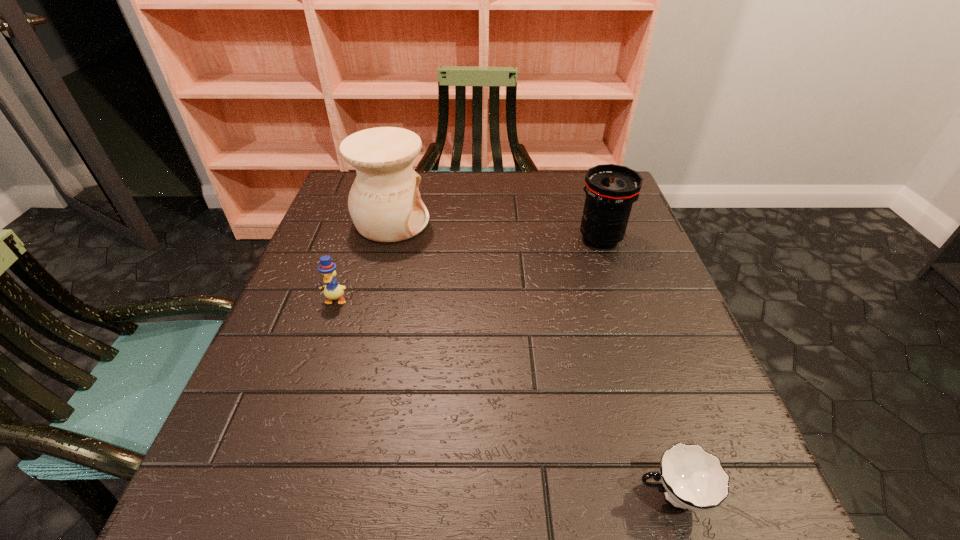
Image resolution: width=960 pixels, height=540 pixels. I want to click on pottery, so click(x=384, y=202).

Locate an element on the screen. The height and width of the screenshot is (540, 960). telephoto lens is located at coordinates (610, 189).

The height and width of the screenshot is (540, 960). Identify the location of the third farthest object. (327, 268).

Find the location of a particular element. The height and width of the screenshot is (540, 960). the third tallest object is located at coordinates (327, 268).

Where is `the nearest object`? The height and width of the screenshot is (540, 960). the nearest object is located at coordinates (692, 478).

Image resolution: width=960 pixels, height=540 pixels. Identify the location of the shortest object. (692, 478).

This screenshot has width=960, height=540. Find the location of `vacant space located at the open side of the pottery`. vacant space located at the open side of the pottery is located at coordinates (516, 222).

Locate an element on the screen. vacant space located on the front of the second tallest object is located at coordinates (639, 354).

Locate an element on the screen. free space located on the face of the third farthest object, where the monocle is placed is located at coordinates coord(280,459).

Where is `vacant region located on the side of the cup with the handle`? This screenshot has width=960, height=540. vacant region located on the side of the cup with the handle is located at coordinates (437, 495).